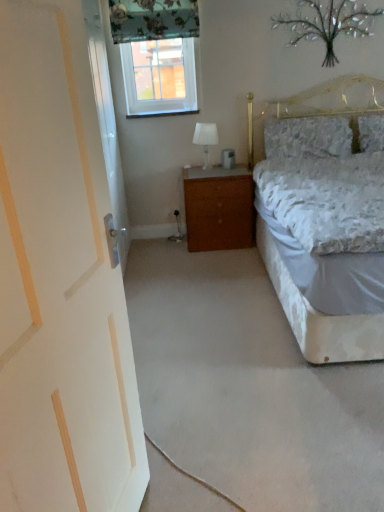
Question: From a real-world perspective, does white glossy door at left stand above fluffy white pillow at upper right, the first pillow positioned from the right?

Choices:
 (A) no
 (B) yes

Answer: (B)

Question: Can you confirm if white glossy door at left is positioned to the left of fluffy white pillow at upper right, which appears as the second pillow when viewed from the left?

Choices:
 (A) no
 (B) yes

Answer: (B)

Question: Is white glossy door at left facing away from fluffy white pillow at upper right, which appears as the second pillow when viewed from the left?

Choices:
 (A) yes
 (B) no

Answer: (B)

Question: Does white glossy door at left have a lesser height compared to fluffy white pillow at upper right, the first pillow positioned from the right?

Choices:
 (A) no
 (B) yes

Answer: (A)

Question: Is white glossy door at left located outside fluffy white pillow at upper right, the first pillow positioned from the right?

Choices:
 (A) yes
 (B) no

Answer: (A)

Question: From the image's perspective, is white glossy door at left located above fluffy white pillow at upper right, which appears as the second pillow when viewed from the left?

Choices:
 (A) no
 (B) yes

Answer: (A)

Question: From a real-world perspective, is white glass table lamp at center over fluffy white pillow at upper right, the first pillow positioned from the right?

Choices:
 (A) yes
 (B) no

Answer: (B)

Question: Is white glass table lamp at center placed right next to fluffy white pillow at upper right, which appears as the second pillow when viewed from the left?

Choices:
 (A) yes
 (B) no

Answer: (B)

Question: Could you tell me if white glass table lamp at center is turned towards fluffy white pillow at upper right, which appears as the second pillow when viewed from the left?

Choices:
 (A) no
 (B) yes

Answer: (A)

Question: Does white glass table lamp at center lie behind fluffy white pillow at upper right, which appears as the second pillow when viewed from the left?

Choices:
 (A) yes
 (B) no

Answer: (B)

Question: Considering the relative sizes of white glass table lamp at center and fluffy white pillow at upper right, the first pillow positioned from the right, in the image provided, is white glass table lamp at center taller than fluffy white pillow at upper right, the first pillow positioned from the right,?

Choices:
 (A) no
 (B) yes

Answer: (B)

Question: Considering the relative sizes of white glass table lamp at center and fluffy white pillow at upper right, the first pillow positioned from the right, in the image provided, is white glass table lamp at center thinner than fluffy white pillow at upper right, the first pillow positioned from the right,?

Choices:
 (A) no
 (B) yes

Answer: (B)

Question: Is fluffy white pillow at upper right, positioned as the 1th pillow in left-to-right order, facing away from white glass table lamp at center?

Choices:
 (A) no
 (B) yes

Answer: (A)